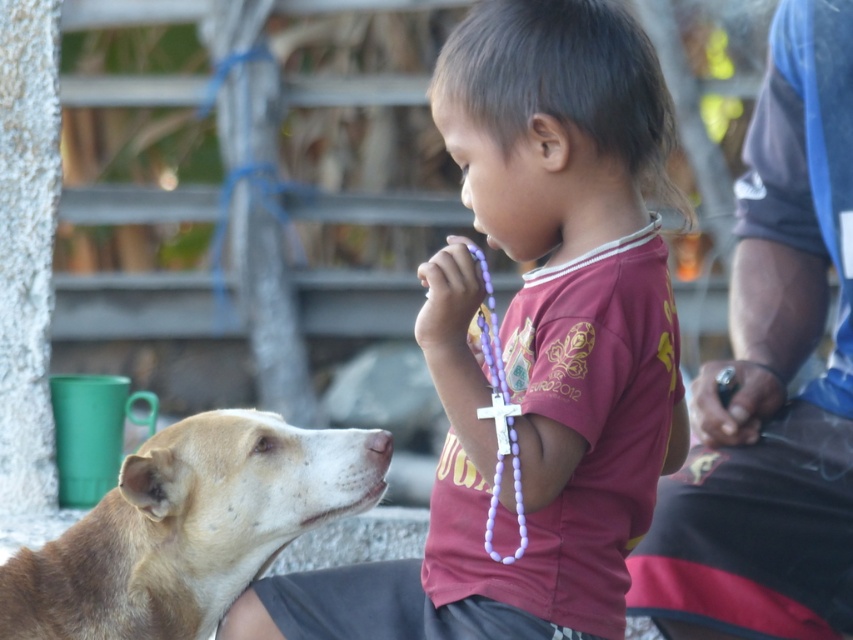
You are a toy designer observing the scene. You need to create a new toy that can be placed between the purple plastic rosary at center and the brown furry dog at lower left. What is the maximum length the toy can be to fit in the space between them?

The maximum length the toy can be is 7.13 inches to fit in the space between the purple plastic rosary at center and the brown furry dog at lower left.

You are a photographer trying to capture the child and the dog in a candid shot. You want to ensure the purple plastic rosary at center and the brown furry dog at lower left are both clearly visible in the frame. Based on their positions, which object is closer to the camera?

The purple plastic rosary at center is in front of the brown furry dog at lower left, so it is closer to the camera.

You are a photographer trying to capture the child and the dog in the image. You want to ensure that both the purple plastic rosary at center and the brown furry dog at lower left are clearly visible in your shot. Which object should you focus on first to ensure proper framing?

The purple plastic rosary at center is wider than the brown furry dog at lower left, so focusing on the purple plastic rosary at center first will help ensure proper framing for both objects.